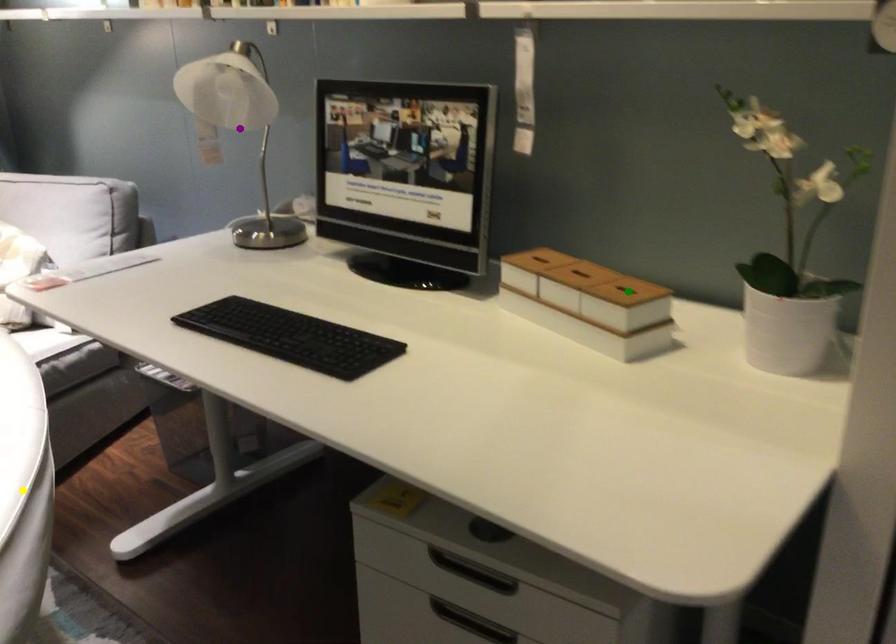
Order these from nearest to farthest:
A) green point
B) purple point
C) yellow point

1. yellow point
2. green point
3. purple point